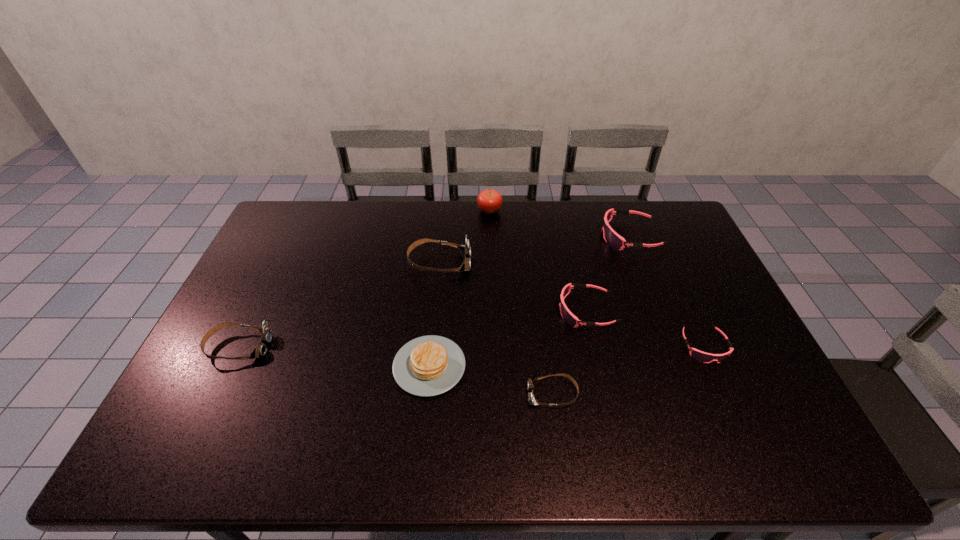
You are a GUI agent. You are given a task and a screenshot of the screen. Output one action in this format:
    pyautogui.click(x=<x>, y=<y>)
    Task: Click on the pink goggles that is the second closest to the leftmost pink goggles
    The height and width of the screenshot is (540, 960).
    Given the screenshot: What is the action you would take?
    pyautogui.click(x=613, y=239)

Image resolution: width=960 pixels, height=540 pixels. I want to click on brown goggles identified as the closest to the biggest brown goggles, so click(x=266, y=333).

Select which brown goggles appears as the third closest to the red apple. Please provide its 2D coordinates. Your answer should be formatted as a tuple, i.e. [(x, y)], where the tuple contains the x and y coordinates of a point satisfying the conditions above.

[(266, 333)]

The width and height of the screenshot is (960, 540). Find the location of `vacant region that satisfies the following two spatial constraints: 1. on the front side of the fifth object from right to left; 2. on the front-facing side of the second nearest brown goggles`. vacant region that satisfies the following two spatial constraints: 1. on the front side of the fifth object from right to left; 2. on the front-facing side of the second nearest brown goggles is located at coordinates (492, 347).

This screenshot has width=960, height=540. I want to click on vacant point that satisfies the following two spatial constraints: 1. on the front-facing side of the second nearest brown goggles; 2. on the left side of the pancake, so click(x=229, y=366).